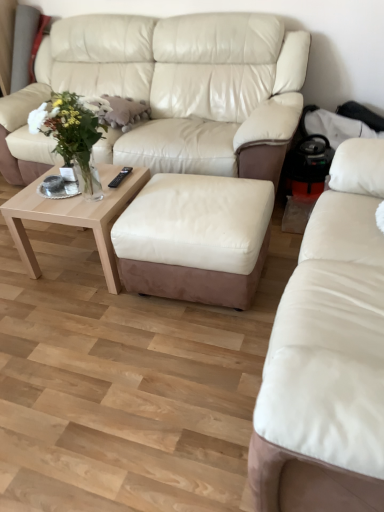
Where is `free spot above white leather ottoman at center (from a real-world perspective)`? This screenshot has width=384, height=512. free spot above white leather ottoman at center (from a real-world perspective) is located at coordinates (204, 197).